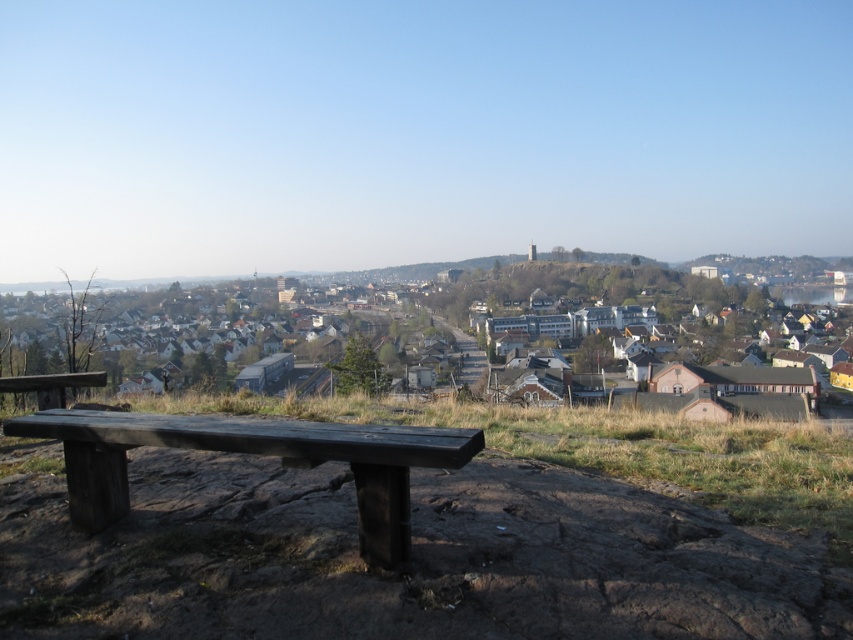
From the picture: You are standing at the center of the image and want to sit on the dark brown wood bench at lower left. In which direction should you move to reach it?

The dark brown wood bench at lower left is located at point (253, 452), so you should move towards the lower left direction to reach it.

You are planning to place a new sculpture exactly between the dark brown wood bench at lower left and the matte brown houses at center. Which object will the sculpture be closer to, and why?

The sculpture will be closer to the dark brown wood bench at lower left because the bench is smaller than the matte brown houses at center.

You are a painter setting up your easel to capture the view of the town. You want to place your easel on the ground so that both the dark brown wood bench at lower left and the wooden bench at lower left are visible in your painting. Which bench should you position your easel closer to in order to ensure both are fully visible?

The dark brown wood bench at lower left has a lesser height compared to wooden bench at lower left. Therefore, positioning the easel closer to the dark brown wood bench at lower left would allow both benches to be fully visible in the painting since the taller wooden bench at lower left won t block the view of the shorter one.